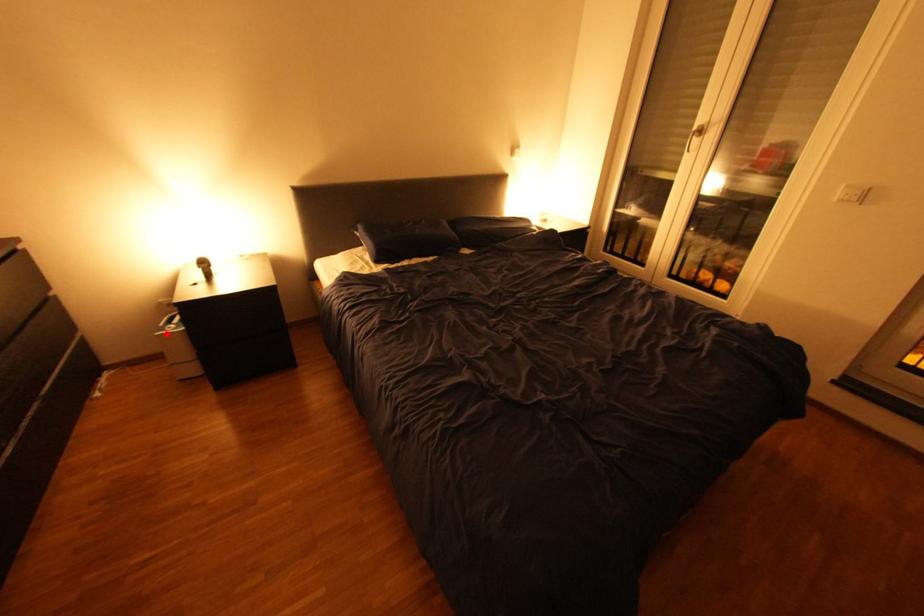
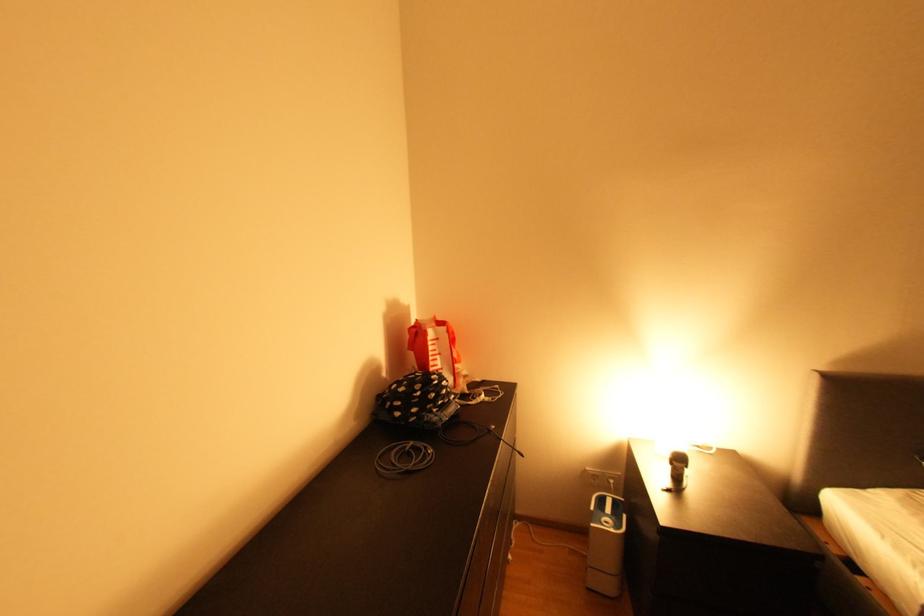
The point at the highlighted location is marked in the first image. Where is the corresponding point in the second image?

(602, 525)